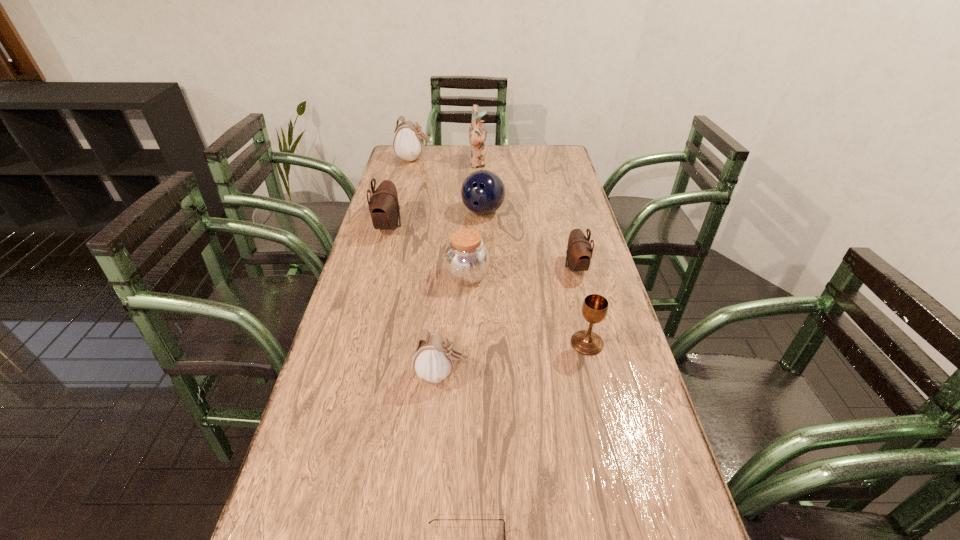
You are a GUI agent. You are given a task and a screenshot of the screen. Output one action in this format:
    pyautogui.click(x=<x>, y=<y>)
    Task: Click on the figurine
    Image resolution: width=960 pixels, height=540 pixels.
    Given the screenshot: What is the action you would take?
    pyautogui.click(x=477, y=135)

Find the location of a particular element. This screenshot has height=540, width=960. the tallest object is located at coordinates (477, 135).

This screenshot has width=960, height=540. In order to click on the farther white pouch in this screenshot , I will do `click(408, 142)`.

The width and height of the screenshot is (960, 540). In order to click on the farthest pouch in this screenshot , I will do `click(408, 142)`.

Image resolution: width=960 pixels, height=540 pixels. What are the coordinates of `the bigger brown pouch` in the screenshot? It's located at (384, 208).

This screenshot has height=540, width=960. What are the coordinates of `the second farthest pouch` in the screenshot? It's located at (384, 208).

This screenshot has width=960, height=540. I want to click on blue bowling ball, so click(x=482, y=192).

At what (x,y) coordinates should I click in order to perform the action: click on brown jar. Please return your answer as a coordinate pair (x, y). Looking at the image, I should click on (466, 260).

Locate an element on the screen. The width and height of the screenshot is (960, 540). chalice is located at coordinates (595, 307).

Image resolution: width=960 pixels, height=540 pixels. Identify the location of the nearer white pouch. (434, 356).